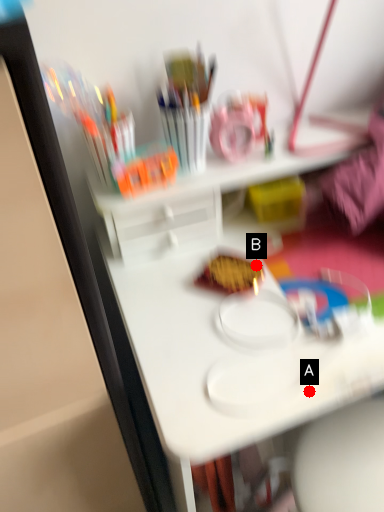
Question: Two points are circled on the image, labeled by A and B beside each circle. Which point appears closest to the camera in this image?

Choices:
 (A) A is closer
 (B) B is closer

Answer: (A)